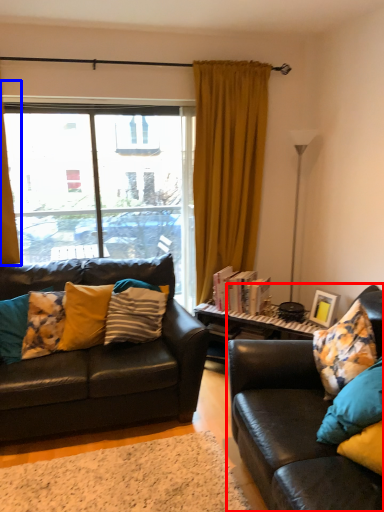
Question: Which point is closer to the camera, studio couch (highlighted by a red box) or curtain (highlighted by a blue box)?

Choices:
 (A) studio couch
 (B) curtain

Answer: (A)